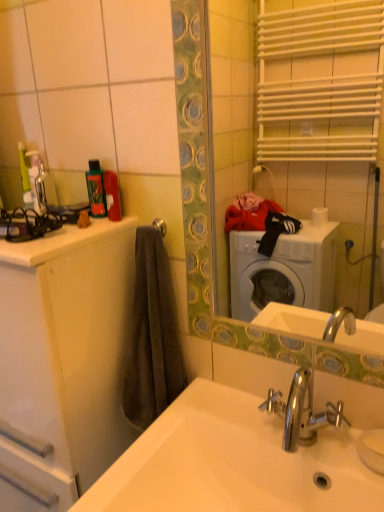
Question: Does white glossy sink at lower center have a larger size compared to white glossy cabinet at left?

Choices:
 (A) no
 (B) yes

Answer: (A)

Question: Does white glossy sink at lower center appear on the left side of white glossy cabinet at left?

Choices:
 (A) no
 (B) yes

Answer: (A)

Question: Does white glossy sink at lower center come in front of white glossy cabinet at left?

Choices:
 (A) no
 (B) yes

Answer: (B)

Question: Does white glossy sink at lower center have a greater height compared to white glossy cabinet at left?

Choices:
 (A) no
 (B) yes

Answer: (A)

Question: Does white glossy sink at lower center have a smaller size compared to white glossy cabinet at left?

Choices:
 (A) yes
 (B) no

Answer: (A)

Question: Is white glossy sink at lower center thinner than white glossy cabinet at left?

Choices:
 (A) yes
 (B) no

Answer: (B)

Question: From a real-world perspective, is white glossy mirror at upper center under white glossy cabinet at left?

Choices:
 (A) yes
 (B) no

Answer: (B)

Question: Does white glossy mirror at upper center have a greater width compared to white glossy cabinet at left?

Choices:
 (A) yes
 (B) no

Answer: (B)

Question: Are white glossy mirror at upper center and white glossy cabinet at left far apart?

Choices:
 (A) no
 (B) yes

Answer: (B)

Question: Is white glossy mirror at upper center to the right of white glossy cabinet at left from the viewer's perspective?

Choices:
 (A) no
 (B) yes

Answer: (B)

Question: Is the position of white glossy mirror at upper center less distant than that of white glossy cabinet at left?

Choices:
 (A) no
 (B) yes

Answer: (B)

Question: From a real-world perspective, does white glossy mirror at upper center stand above white glossy cabinet at left?

Choices:
 (A) no
 (B) yes

Answer: (B)

Question: Does green plastic bottle at upper left have a lesser height compared to white glossy mirror at upper center?

Choices:
 (A) no
 (B) yes

Answer: (B)